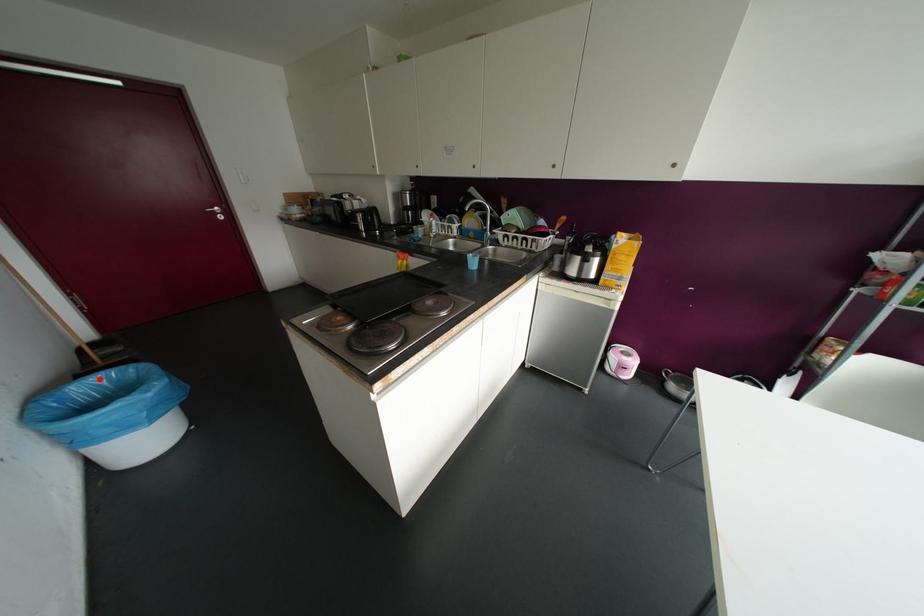
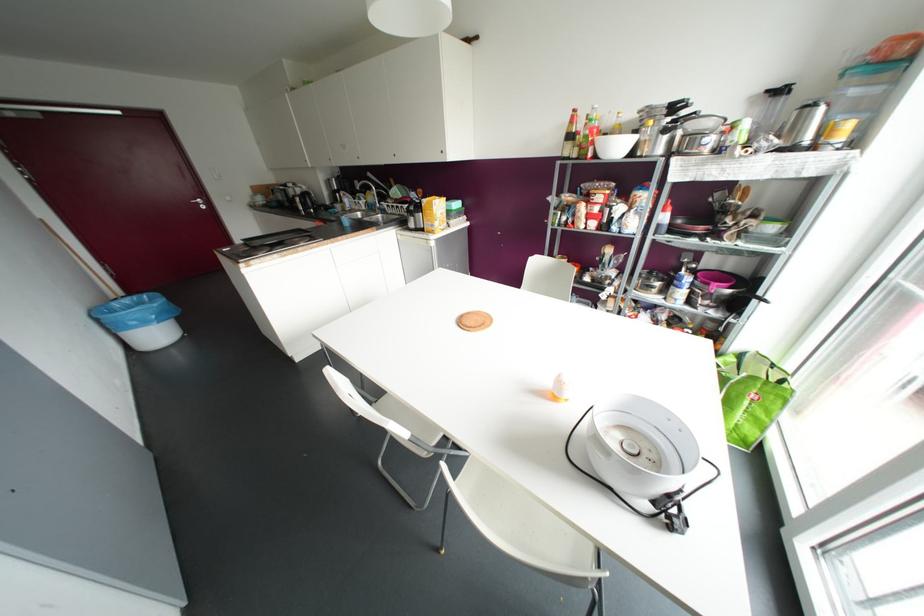
Question: I am providing you with two images of the same scene from different viewpoints. Image1 has a red point marked. In image2, the corresponding 3D location appears at what relative position? Reply with the corresponding letter.

Choices:
 (A) Closer
 (B) Farther

Answer: (A)